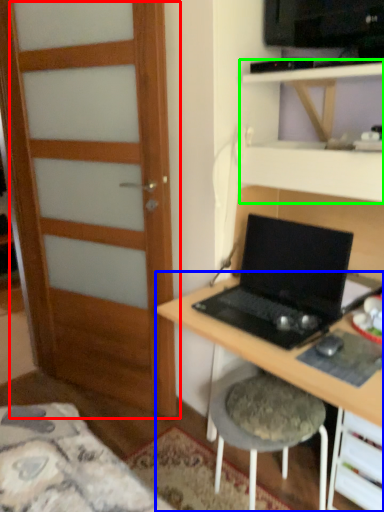
Question: Estimate the real-world distances between objects in this image. Which object is closer to door (highlighted by a red box), desk (highlighted by a blue box) or shelf (highlighted by a green box)?

Choices:
 (A) desk
 (B) shelf

Answer: (A)